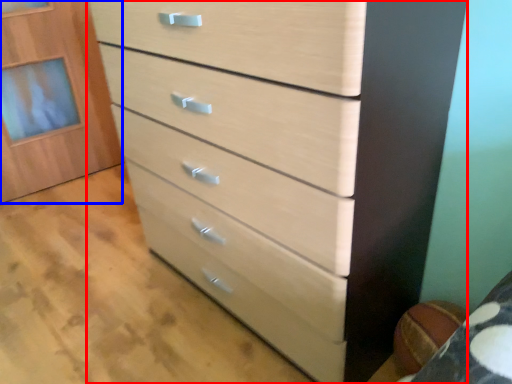
Question: Which object appears farthest to the camera in this image, chest of drawers (highlighted by a red box) or cabinetry (highlighted by a blue box)?

Choices:
 (A) chest of drawers
 (B) cabinetry

Answer: (B)